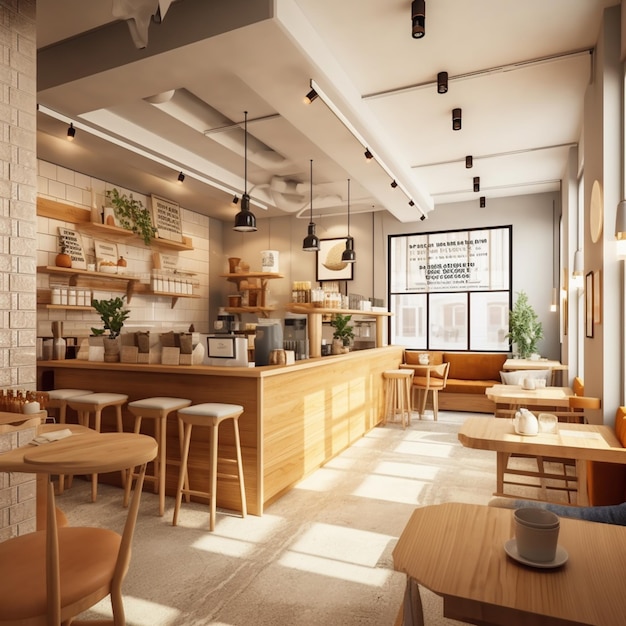
Identify the location of table. This screenshot has height=626, width=626. (494, 434), (470, 545), (562, 392), (519, 361), (424, 366).